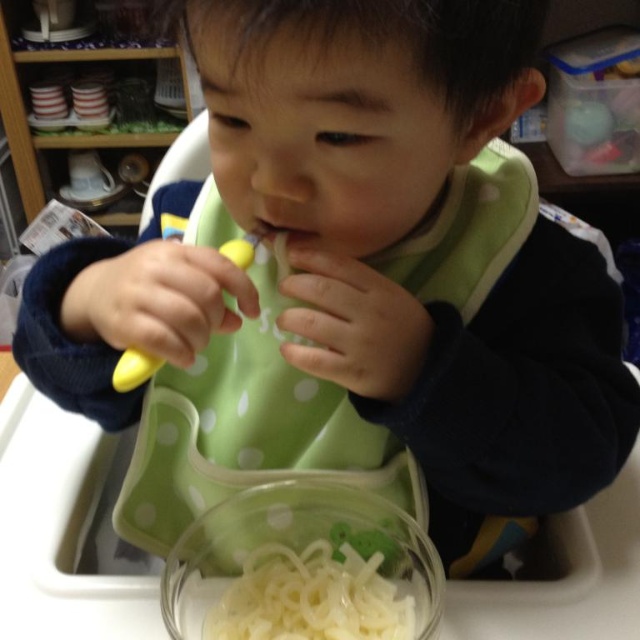
Between translucent plastic bowl at lower center and white glossy noodles at lower center, which one is positioned higher?

translucent plastic bowl at lower center is above.

Between translucent plastic bowl at lower center and white glossy noodles at lower center, which one has less height?

white glossy noodles at lower center is shorter.

Is point (433, 552) closer to camera compared to point (289, 609)?

Yes.

Where is `translucent plastic bowl at lower center`? The width and height of the screenshot is (640, 640). translucent plastic bowl at lower center is located at coordinates (301, 568).

Can you confirm if translucent plastic bowl at lower center is positioned above pink matte flesh at center?

Actually, translucent plastic bowl at lower center is below pink matte flesh at center.

Does point (292, 570) lie in front of point (268, 228)?

No.

Is point (371, 582) positioned before point (262, 232)?

No, (371, 582) is behind (262, 232).

Find the location of a particular element. translucent plastic bowl at lower center is located at coordinates (301, 568).

Can you confirm if white glossy noodles at lower center is positioned to the right of pink matte flesh at center?

Correct, you'll find white glossy noodles at lower center to the right of pink matte flesh at center.

Describe the element at coordinates (310, 596) in the screenshot. The width and height of the screenshot is (640, 640). I see `white glossy noodles at lower center` at that location.

At what (x,y) coordinates should I click in order to perform the action: click on white glossy noodles at lower center. Please return your answer as a coordinate pair (x, y). This screenshot has width=640, height=640. Looking at the image, I should click on (310, 596).